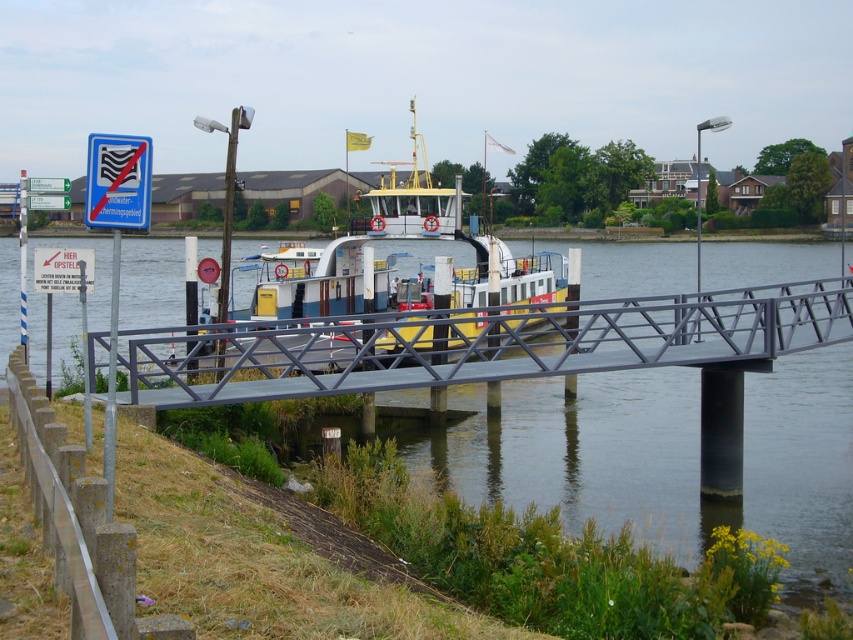
You are standing at the ferry docked at a pier and want to cross to the other side. The metallic gray bridge at lower center is your only option. Can you walk directly to it from your current position?

Yes, because the metallic gray bridge at lower center is located at point (483, 344), which is directly accessible from the ferry dock.

You are a pedestrian standing on the metallic gray bridge at lower center and want to board the yellow painted metal ferry at center. Which direction should you walk to reach the ferry?

You should walk forward because the metallic gray bridge at lower center is below the yellow painted metal ferry at center, so moving straight ahead along the bridge will lead you directly to the ferry.

You are a delivery person carrying a large package that requires a path at least 2 meters wide. You need to choose between crossing the metallic gray bridge at lower center or boarding the yellow painted metal ferry at center. Based on their widths, which option provides enough space for your package?

The yellow painted metal ferry at center has a greater width than the metallic gray bridge at lower center. Since the ferry is wider, it can accommodate the 2 meter requirement, making it the suitable choice for transporting your large package.